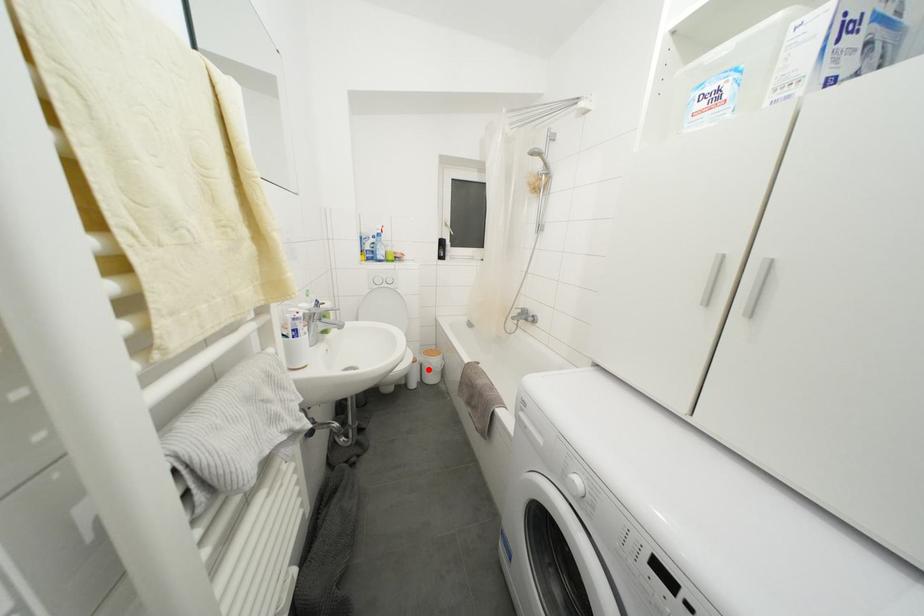
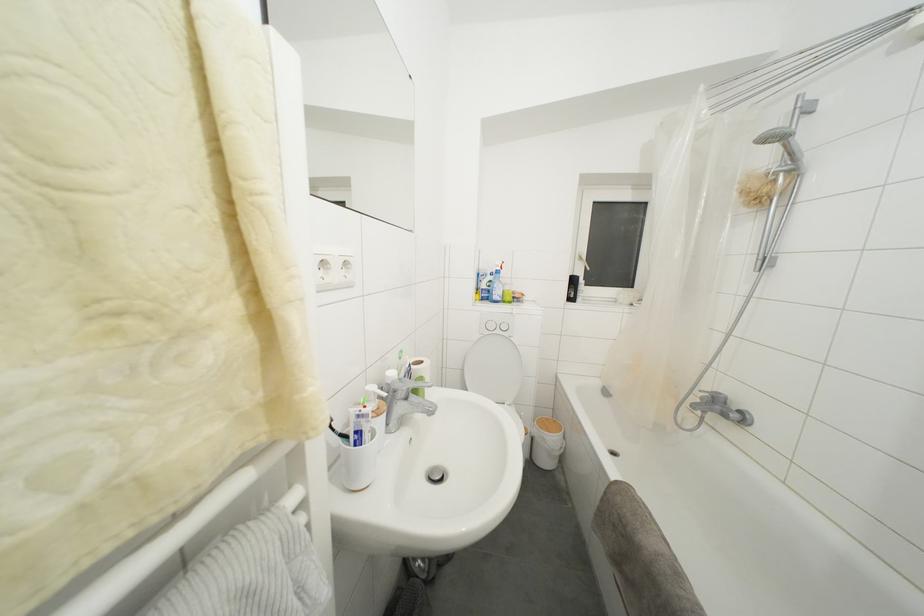
In the second image, find the point that corresponds to the highlighted location in the first image.

(541, 445)